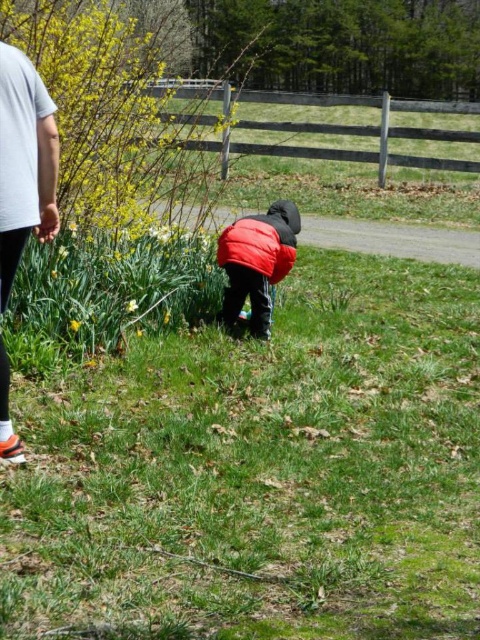
Question: Which point is closer to the camera taking this photo?

Choices:
 (A) click(x=46, y=140)
 (B) click(x=252, y=275)

Answer: (A)

Question: Among these objects, which one is nearest to the camera?

Choices:
 (A) matte red jacket at center
 (B) white cotton shirt at upper left

Answer: (B)

Question: Is white cotton shirt at upper left positioned at the back of matte red jacket at center?

Choices:
 (A) no
 (B) yes

Answer: (A)

Question: Does white cotton shirt at upper left have a larger size compared to matte red jacket at center?

Choices:
 (A) no
 (B) yes

Answer: (A)

Question: Is the position of white cotton shirt at upper left more distant than that of matte red jacket at center?

Choices:
 (A) no
 (B) yes

Answer: (A)